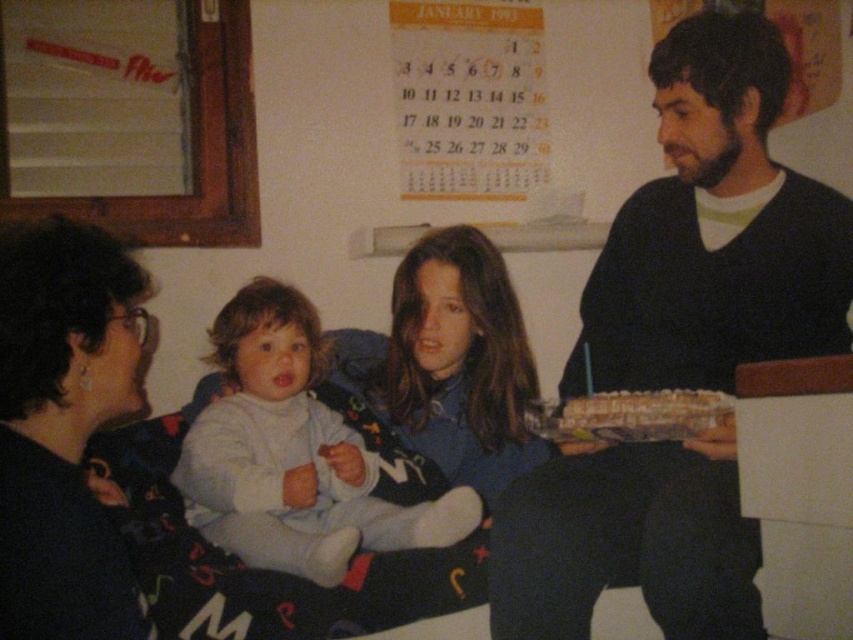
Question: Can you confirm if dark blue sweater at center is bigger than dark blue fabric at left?

Choices:
 (A) yes
 (B) no

Answer: (A)

Question: Is dark blue fabric at left positioned behind light blue fabric baby at center?

Choices:
 (A) no
 (B) yes

Answer: (A)

Question: Is dark blue fabric at left to the right of matte blue sweater at center from the viewer's perspective?

Choices:
 (A) yes
 (B) no

Answer: (B)

Question: Which point appears closest to the camera in this image?

Choices:
 (A) (71, 243)
 (B) (294, 529)
 (C) (693, 540)

Answer: (A)

Question: Which object is the closest to the matte blue sweater at center?

Choices:
 (A) light blue fabric baby at center
 (B) dark blue sweater at center
 (C) dark blue fabric at left

Answer: (A)

Question: Which object is farther from the camera taking this photo?

Choices:
 (A) matte blue sweater at center
 (B) dark blue sweater at center
 (C) light blue fabric baby at center
 (D) dark blue fabric at left

Answer: (A)